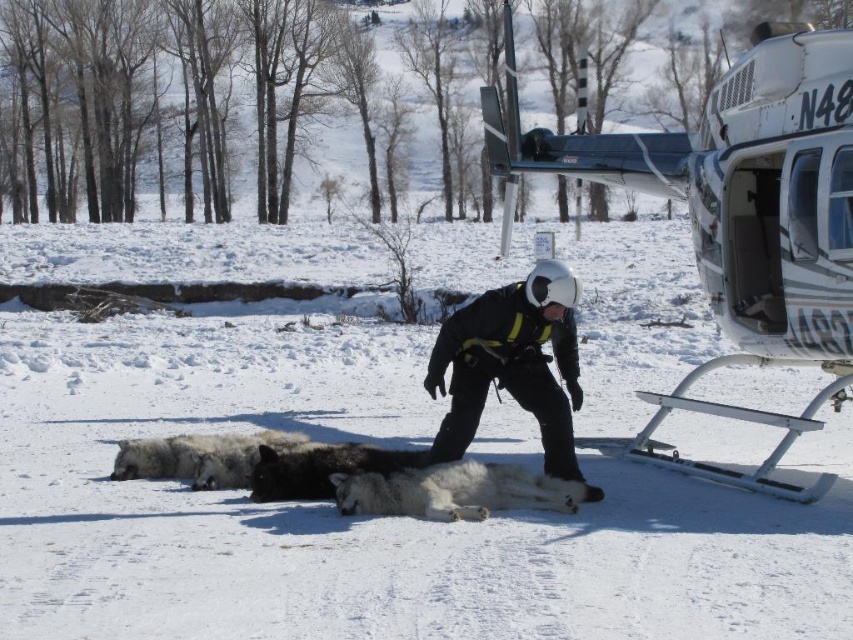
Question: Based on their relative distances, which object is nearer to the black fur dog at lower center?

Choices:
 (A) black matte skier at center
 (B) white fluffy dog at center
 (C) white glossy helicopter at right
 (D) white fluffy snow at center

Answer: (B)

Question: Is black matte skier at center wider than black fur dog at center?

Choices:
 (A) yes
 (B) no

Answer: (A)

Question: Does white glossy helicopter at right appear on the right side of black fur dog at center?

Choices:
 (A) yes
 (B) no

Answer: (A)

Question: Which point is closer to the camera taking this photo?

Choices:
 (A) (374, 509)
 (B) (402, 557)
 (C) (799, 54)

Answer: (B)

Question: Is white glossy helicopter at right bigger than white fluffy dog at center?

Choices:
 (A) no
 (B) yes

Answer: (B)

Question: Which object is the closest to the white fluffy dog at center?

Choices:
 (A) white glossy helicopter at right
 (B) white fluffy snow at center
 (C) black fur dog at lower center
 (D) black matte skier at center

Answer: (D)